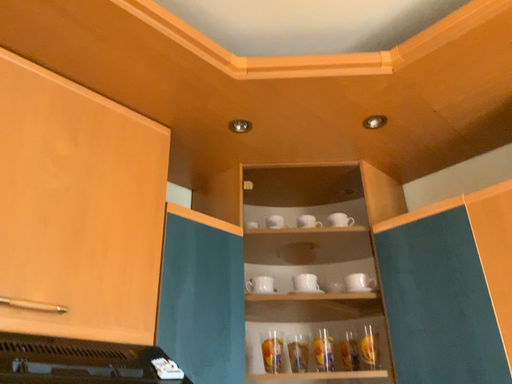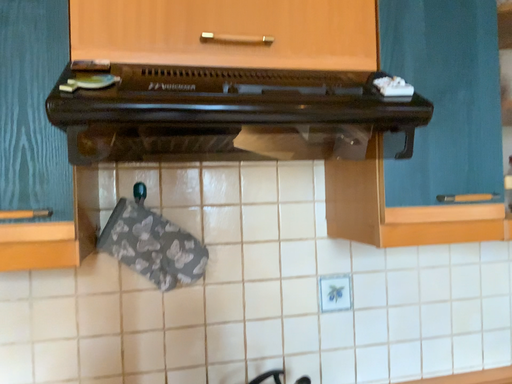
Question: How did the camera likely rotate when shooting the video?

Choices:
 (A) rotated right
 (B) rotated left

Answer: (B)